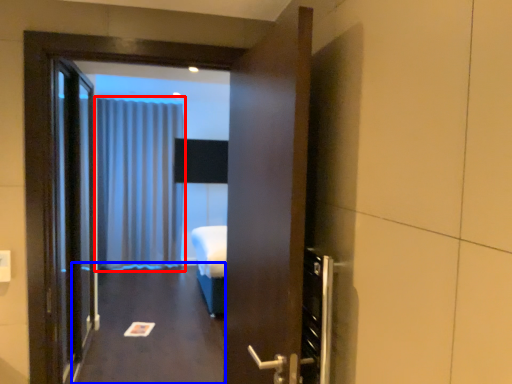
Question: Which point is further to the camera, curtain (highlighted by a red box) or corridor (highlighted by a blue box)?

Choices:
 (A) curtain
 (B) corridor

Answer: (A)